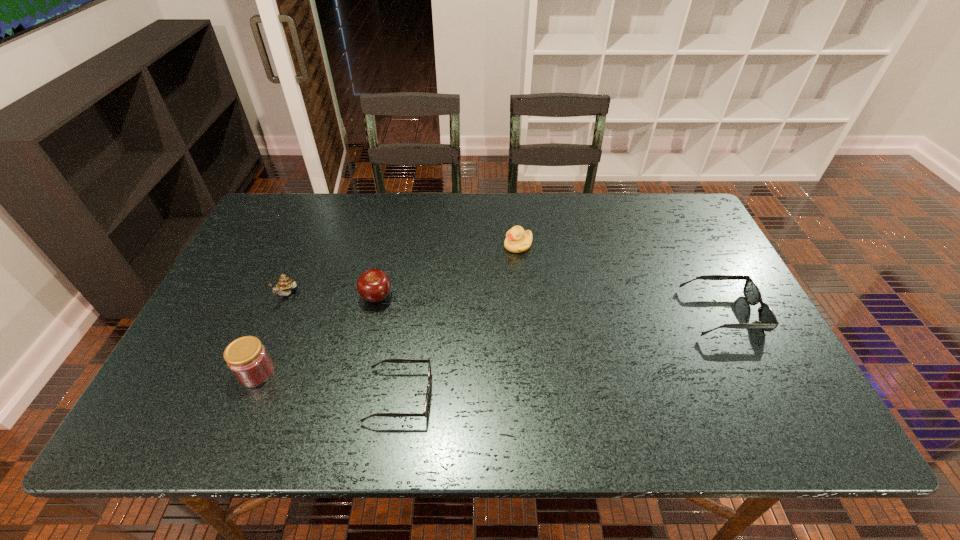
Identify the location of jam present at the left edge. The image size is (960, 540). (247, 358).

Where is `object present at the right edge`? This screenshot has width=960, height=540. object present at the right edge is located at coordinates (767, 319).

Identify the location of object that is at the near left corner. (247, 358).

In the image, there is a desktop. At what (x,y) coordinates should I click in order to perform the action: click on vacant space at the far edge. Please return your answer as a coordinate pair (x, y). The width and height of the screenshot is (960, 540). Looking at the image, I should click on (591, 194).

The image size is (960, 540). In the image, there is a desktop. In order to click on vacant region at the left edge in this screenshot , I will do `click(287, 272)`.

This screenshot has width=960, height=540. Identify the location of vacant space at the right edge. (751, 352).

This screenshot has height=540, width=960. Identify the location of free space at the far left corner. (271, 234).

This screenshot has height=540, width=960. I want to click on free spot at the far right corner of the desktop, so click(661, 226).

Find the location of a particular element. The height and width of the screenshot is (540, 960). vacant area that lies between the left sunglasses and the fourth tallest object is located at coordinates (459, 321).

Where is `free area in between the jam and the farthest object`? The image size is (960, 540). free area in between the jam and the farthest object is located at coordinates (388, 309).